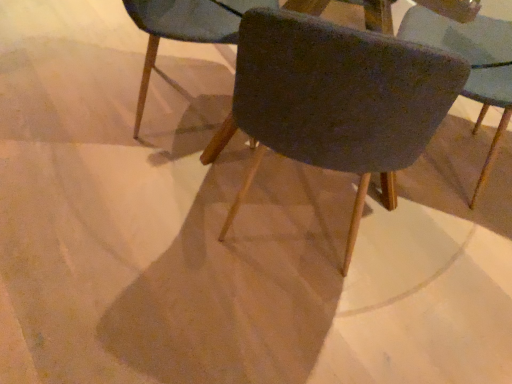
Question: From the image's perspective, is velvet dark blue chair at center, the 1th chair in the left-to-right sequence, over velvet dark blue chair at center, which is the 1th chair from right to left?

Choices:
 (A) yes
 (B) no

Answer: (A)

Question: Can you confirm if velvet dark blue chair at center, the 1th chair in the left-to-right sequence, is smaller than velvet dark blue chair at center, which is the 1th chair from right to left?

Choices:
 (A) yes
 (B) no

Answer: (A)

Question: Is velvet dark blue chair at center, the 3th chair from the right, next to velvet dark blue chair at center, the 3th chair viewed from the left?

Choices:
 (A) yes
 (B) no

Answer: (B)

Question: Could you tell me if velvet dark blue chair at center, the 3th chair from the right, is turned towards velvet dark blue chair at center, which is the 1th chair from right to left?

Choices:
 (A) yes
 (B) no

Answer: (A)

Question: Is velvet dark blue chair at center, the 1th chair in the left-to-right sequence, further to camera compared to velvet dark blue chair at center, which is the 1th chair from right to left?

Choices:
 (A) yes
 (B) no

Answer: (A)

Question: Is velvet dark blue chair at center, the 1th chair in the left-to-right sequence, to the left of velvet dark blue chair at center, which is the 1th chair from right to left, from the viewer's perspective?

Choices:
 (A) yes
 (B) no

Answer: (A)

Question: Does velvet dark blue chair at center, the 3th chair viewed from the left, come behind velvet dark blue chair at center, the 3th chair from the right?

Choices:
 (A) yes
 (B) no

Answer: (B)

Question: Is velvet dark blue chair at center, the 3th chair viewed from the left, oriented towards velvet dark blue chair at center, the 3th chair from the right?

Choices:
 (A) no
 (B) yes

Answer: (B)

Question: Is velvet dark blue chair at center, which is the 1th chair from right to left, positioned in front of velvet dark blue chair at center, the 3th chair from the right?

Choices:
 (A) yes
 (B) no

Answer: (A)

Question: Can you confirm if velvet dark blue chair at center, which is the 1th chair from right to left, is taller than velvet dark blue chair at center, the 3th chair from the right?

Choices:
 (A) yes
 (B) no

Answer: (A)

Question: Does velvet dark blue chair at center, which is the 1th chair from right to left, have a lesser width compared to velvet dark blue chair at center, the 1th chair in the left-to-right sequence?

Choices:
 (A) yes
 (B) no

Answer: (A)

Question: From the image's perspective, is velvet dark blue chair at center, the 3th chair viewed from the left, over velvet dark blue chair at center, the 1th chair in the left-to-right sequence?

Choices:
 (A) no
 (B) yes

Answer: (A)

Question: Is velvet dark blue chair at center, the 1th chair in the left-to-right sequence, positioned far away from velvet dark blue chair at center, placed as the 2th chair when sorted from left to right?

Choices:
 (A) yes
 (B) no

Answer: (B)